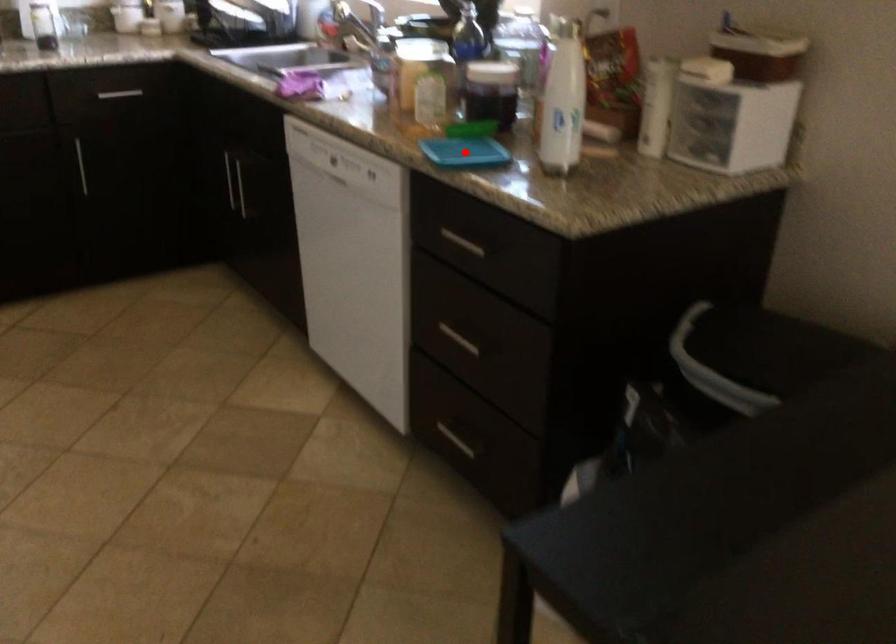
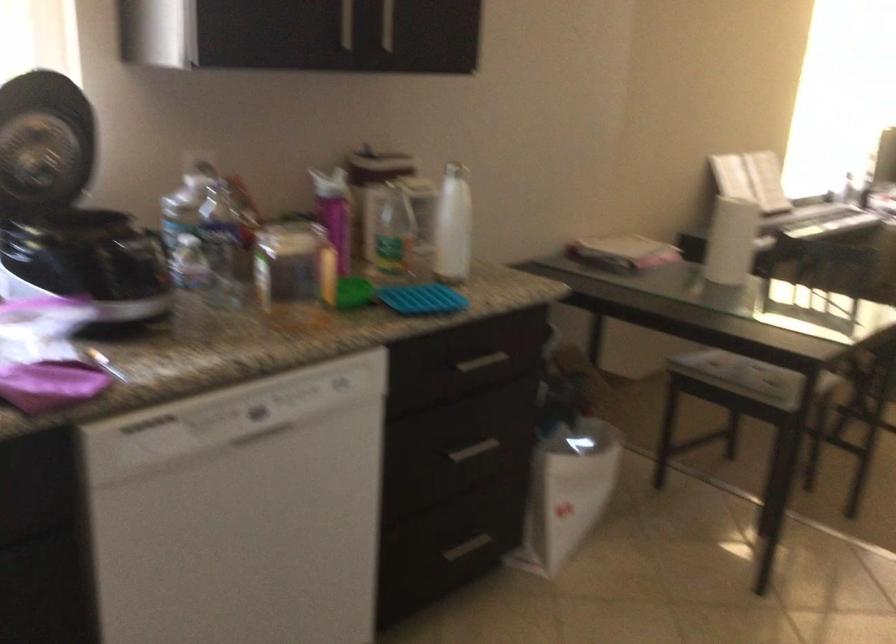
Question: I am providing you with two images of the same scene from different viewpoints. A red point is marked on the first image. Can you still see the location of the red point in image 2?

Choices:
 (A) Yes
 (B) No

Answer: (B)